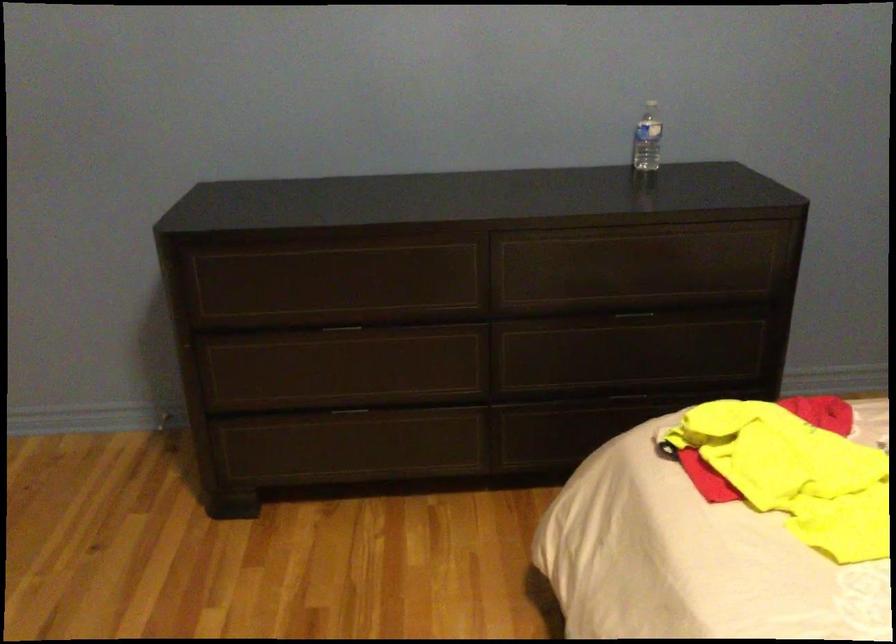
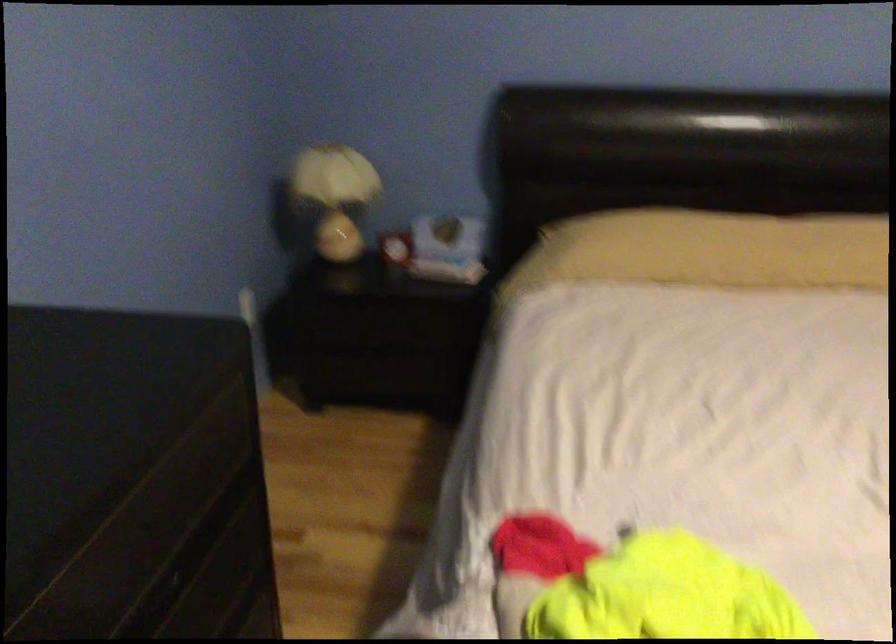
Where in the second image is the point corresponding to the point at 687,303 from the first image?

(186, 559)